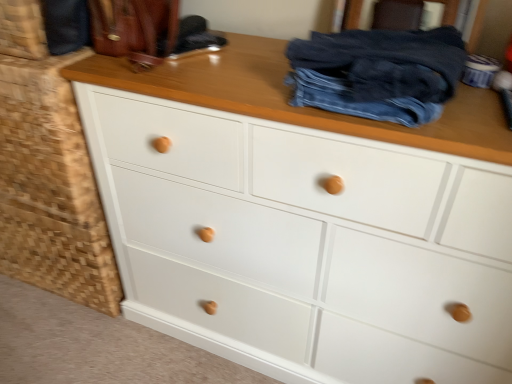
Describe the element at coordinates (51, 188) in the screenshot. I see `white wood drawer at lower left` at that location.

Identify the location of white wood drawer at lower left. (51, 188).

Describe the element at coordinates (378, 72) in the screenshot. The width and height of the screenshot is (512, 384). I see `denim at center` at that location.

At what (x,y) coordinates should I click in order to perform the action: click on denim at center. Please return your answer as a coordinate pair (x, y). This screenshot has width=512, height=384. Looking at the image, I should click on (378, 72).

Locate an element on the screen. The image size is (512, 384). white wood drawer at lower left is located at coordinates (51, 188).

Which is more to the right, white wood drawer at lower left or denim at center?

From the viewer's perspective, denim at center appears more on the right side.

Between white wood drawer at lower left and denim at center, which one is positioned in front?

denim at center is closer to the camera.

Is point (55, 288) less distant than point (446, 91)?

No, (55, 288) is further to viewer.

From the image's perspective, is white wood drawer at lower left located beneath denim at center?

Yes.

From a real-world perspective, is white wood drawer at lower left physically located above or below denim at center?

From a real-world perspective, white wood drawer at lower left is physically below denim at center.

Can you confirm if white wood drawer at lower left is wider than denim at center?

Correct, the width of white wood drawer at lower left exceeds that of denim at center.

Is white wood drawer at lower left taller or shorter than denim at center?

Considering their sizes, white wood drawer at lower left has more height than denim at center.

Does white wood drawer at lower left have a smaller size compared to denim at center?

No, white wood drawer at lower left is not smaller than denim at center.

Could denim at center be considered to be inside white wood drawer at lower left?

Definitely not — denim at center is not inside white wood drawer at lower left.

Is white wood drawer at lower left positioned far away from denim at center?

No, there isn't a large distance between white wood drawer at lower left and denim at center.

Is white wood drawer at lower left looking in the opposite direction of denim at center?

white wood drawer at lower left is not turned away from denim at center.

Can you tell me how much white wood drawer at lower left and denim at center differ in facing direction?

1.03 degrees separate the facing orientations of white wood drawer at lower left and denim at center.

At what (x,y) coordinates should I click in order to perform the action: click on cabinetry behind the denim at center. Please return your answer as a coordinate pair (x, y). Looking at the image, I should click on (51, 188).

In the scene shown: Between denim at center and white wood drawer at lower left, which one appears on the left side from the viewer's perspective?

From the viewer's perspective, white wood drawer at lower left appears more on the left side.

Is denim at center positioned in front of white wood drawer at lower left?

Yes, denim at center is in front of white wood drawer at lower left.

Is point (462, 55) more distant than point (61, 141)?

No, it is not.

From the image's perspective, is denim at center located above white wood drawer at lower left?

Yes.

In the scene shown: From a real-world perspective, which object stands above the other?

denim at center, from a real-world perspective.

Which object is thinner, denim at center or white wood drawer at lower left?

denim at center.

Which of these two, denim at center or white wood drawer at lower left, stands taller?

white wood drawer at lower left.

Considering the sizes of objects denim at center and white wood drawer at lower left in the image provided, who is bigger, denim at center or white wood drawer at lower left?

Bigger between the two is white wood drawer at lower left.

Would you say denim at center is outside white wood drawer at lower left?

Yes, denim at center is located beyond the bounds of white wood drawer at lower left.

Is denim at center beside white wood drawer at lower left?

No, denim at center is not with white wood drawer at lower left.

Is denim at center facing towards white wood drawer at lower left?

No, denim at center is not facing towards white wood drawer at lower left.

Where is `clothing above the white wood drawer at lower left (from a real-world perspective)`? The height and width of the screenshot is (384, 512). clothing above the white wood drawer at lower left (from a real-world perspective) is located at coordinates (378, 72).

You are a GUI agent. You are given a task and a screenshot of the screen. Output one action in this format:
    pyautogui.click(x=<x>, y=<y>)
    Task: Click on the cabinetry below the denim at center (from the image's perspective)
    
    Given the screenshot: What is the action you would take?
    pyautogui.click(x=51, y=188)

In order to click on clothing located in front of the white wood drawer at lower left in this screenshot , I will do `click(378, 72)`.